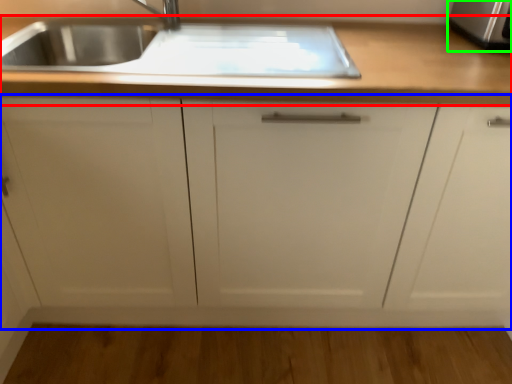
Question: Based on their relative distances, which object is farther from countertop (highlighted by a red box)? Choose from cabinetry (highlighted by a blue box) and stainless steel (highlighted by a green box).

Choices:
 (A) cabinetry
 (B) stainless steel

Answer: (B)